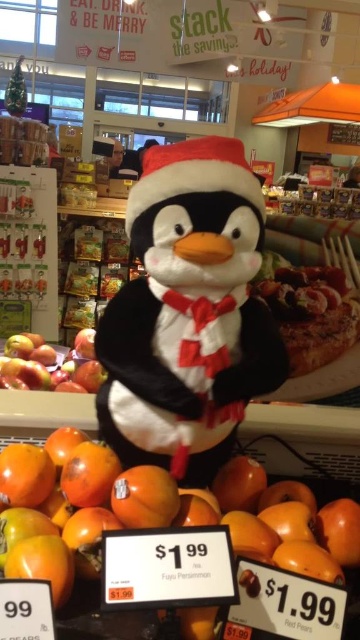
You are a customer in the grocery store looking at the festive display. You want to know if the white plush penguin at center is taller than the glossy red apple at left. Can you determine this based on the display?

The white plush penguin at center has a greater height compared to the glossy red apple at left, so yes, the white plush penguin at center is taller than the glossy red apple at left.

You are a delivery person who needs to place the white plush penguin at center and the orange matte fuji persimmon at center into a box. The box can only fit items that are no thicker than 10 cm. Which item might not fit if the penguin is 8 cm thick?

The orange matte fuji persimmon at center might not fit because it is thicker than the white plush penguin at center, which is 8 cm. Since the box has a 10 cm thickness limit, the persimmon could exceed this if its thickness is over 10 cm.